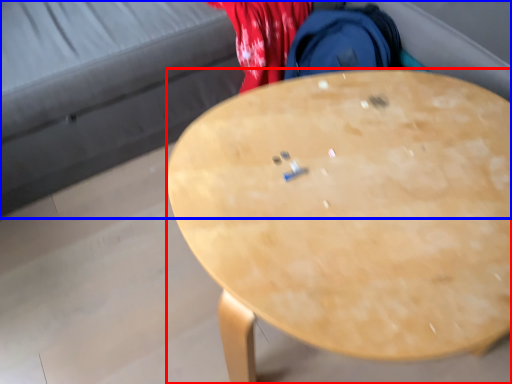
Question: Which object appears closest to the camera in this image, desk (highlighted by a red box) or studio couch (highlighted by a blue box)?

Choices:
 (A) desk
 (B) studio couch

Answer: (A)